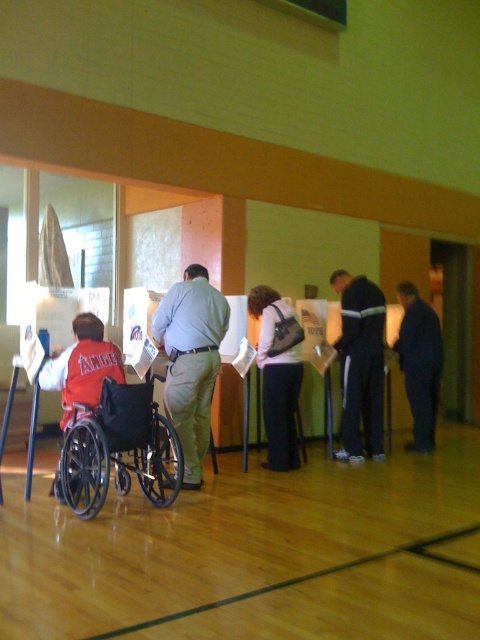
You are a photographer taking a picture of the light green fabric pants at center and the dark blue jeans at center. Which clothing item is covering the other one?

The light green fabric pants at center is positioned over dark blue jeans at center, so it is covering the dark blue jeans at center.

You are a photographer trying to capture a candid shot of the dark gray fabric jacket at center and the dark blue jeans at center. Since you want to ensure both are visible in the frame, which clothing item should you focus on first to avoid missing either in your shot?

The dark gray fabric jacket at center has a lesser height compared to dark blue jeans at center, so you should focus on the dark gray fabric jacket at center first to ensure it is fully captured in the frame before the jeans, which are taller.

You are a poll worker setting up a voting booth that requires a minimum width of 1 meter to accommodate wheelchair access. You have two items in the way at the center of the scene, the dark gray fabric jacket at center and the dark blue jeans at center. Which item should you move to ensure the booth meets accessibility requirements?

The dark gray fabric jacket at center might be wider than dark blue jeans at center, so you should move the dark gray fabric jacket at center to ensure the booth meets accessibility requirements.